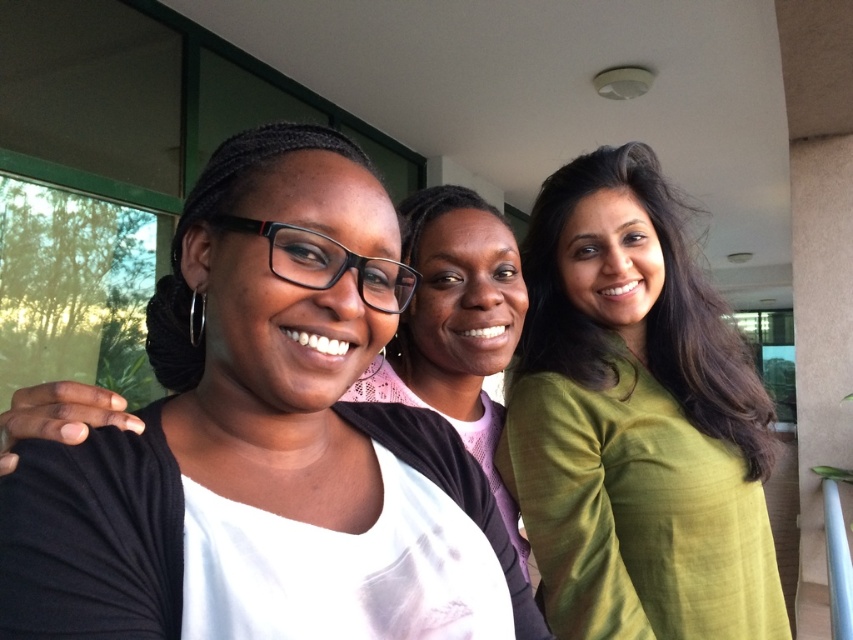
Does matte black shirt at center have a lesser width compared to green silk shirt at right?

Yes, matte black shirt at center is thinner than green silk shirt at right.

Can you confirm if matte black shirt at center is positioned to the left of green silk shirt at right?

Correct, you'll find matte black shirt at center to the left of green silk shirt at right.

The width and height of the screenshot is (853, 640). What are the coordinates of `matte black shirt at center` in the screenshot? It's located at (257, 426).